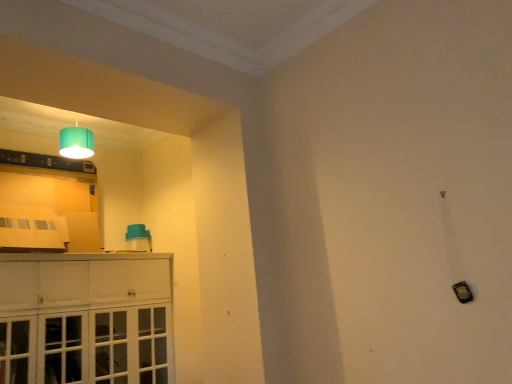
What are the coordinates of `white glossy cabinet at lower left` in the screenshot? It's located at (86, 318).

What do you see at coordinates (86, 318) in the screenshot? I see `white glossy cabinet at lower left` at bounding box center [86, 318].

The image size is (512, 384). Find the location of `white glossy cabinet at lower left`. white glossy cabinet at lower left is located at coordinates (86, 318).